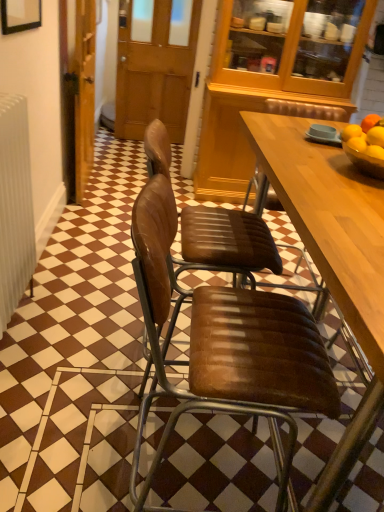
Identify the location of vacant area that is in front of brown wooden door at center. The height and width of the screenshot is (512, 384). (116, 184).